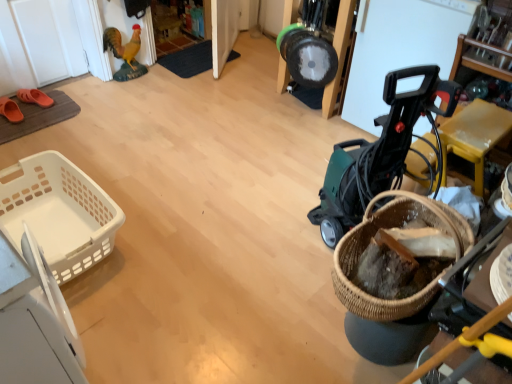
At what (x,y) coordinates should I click in order to perform the action: click on unoccupied region to the right of orange rubber clog at left, which ranks as the 1th footwear in back-to-front order. Please return your answer as a coordinate pair (x, y). The width and height of the screenshot is (512, 384). Looking at the image, I should click on (60, 108).